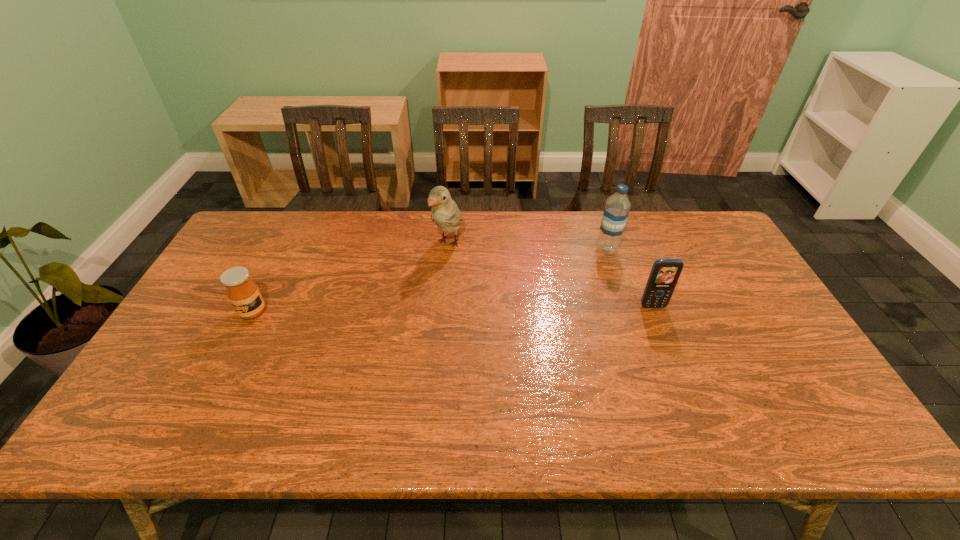
You are a GUI agent. You are given a task and a screenshot of the screen. Output one action in this format:
    pyautogui.click(x=<x>, y=<y>)
    Task: Click on the honey
    This screenshot has width=960, height=540.
    Given the screenshot: What is the action you would take?
    pyautogui.click(x=242, y=292)

I want to click on the leftmost object, so click(242, 292).

Where is `the rightmost object`? This screenshot has width=960, height=540. the rightmost object is located at coordinates (664, 275).

You are a GUI agent. You are given a task and a screenshot of the screen. Output one action in this format:
    pyautogui.click(x=<x>, y=<y>)
    Task: Click on the second shortest object
    
    Given the screenshot: What is the action you would take?
    pyautogui.click(x=664, y=275)

At what (x,y) coordinates should I click in order to perform the action: click on the second object from right to left. Please return your answer as a coordinate pair (x, y). The image size is (960, 540). Looking at the image, I should click on (617, 207).

Where is `bird`? bird is located at coordinates (444, 212).

Where is `free location located on the front-facing side of the leftmost object`? free location located on the front-facing side of the leftmost object is located at coordinates (229, 358).

Where is `free point located on the screen of the cellular telephone`? This screenshot has height=540, width=960. free point located on the screen of the cellular telephone is located at coordinates (663, 335).

Where is `vacant area situated 0.150m on the label of the third object from left to right`? vacant area situated 0.150m on the label of the third object from left to right is located at coordinates 565,273.

Identify the location of vacant space located 0.050m on the label of the third object from left to right. This screenshot has width=960, height=540. (588, 260).